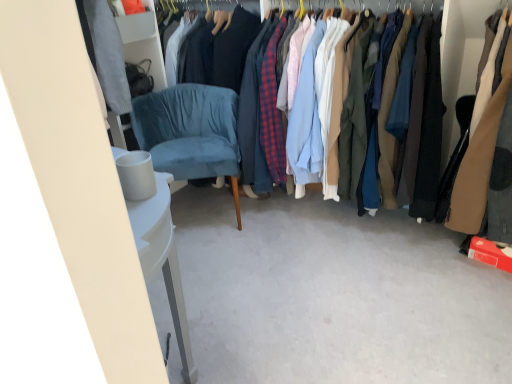
Question: Which direction should I rotate to look at matte cotton shirts at center, which is counted as the 2th clothing, starting from the right, — up or down?

Choices:
 (A) down
 (B) up

Answer: (B)

Question: Is velvet blue armchair at center-left turned away from matte cotton shirts at center, which is counted as the 2th clothing, starting from the right?

Choices:
 (A) no
 (B) yes

Answer: (A)

Question: From the image's perspective, would you say velvet blue armchair at center-left is positioned over matte cotton shirts at center, arranged as the 1th clothing when viewed from the left?

Choices:
 (A) yes
 (B) no

Answer: (B)

Question: Is velvet blue armchair at center-left placed right next to matte cotton shirts at center, arranged as the 1th clothing when viewed from the left?

Choices:
 (A) no
 (B) yes

Answer: (A)

Question: From a real-world perspective, is velvet blue armchair at center-left on matte cotton shirts at center, which is counted as the 2th clothing, starting from the right?

Choices:
 (A) no
 (B) yes

Answer: (A)

Question: Can you confirm if velvet blue armchair at center-left is taller than matte cotton shirts at center, arranged as the 1th clothing when viewed from the left?

Choices:
 (A) yes
 (B) no

Answer: (B)

Question: From the image's perspective, is velvet blue armchair at center-left below matte cotton shirts at center, arranged as the 1th clothing when viewed from the left?

Choices:
 (A) yes
 (B) no

Answer: (A)

Question: Is white matte trash bin at lower left completely or partially outside of brown leather jacket at right, which appears as the first clothing when viewed from the right?

Choices:
 (A) yes
 (B) no

Answer: (A)

Question: Would you consider white matte trash bin at lower left to be distant from brown leather jacket at right, the second clothing viewed from the left?

Choices:
 (A) yes
 (B) no

Answer: (A)

Question: Considering the relative sizes of white matte trash bin at lower left and brown leather jacket at right, the second clothing viewed from the left, in the image provided, is white matte trash bin at lower left smaller than brown leather jacket at right, the second clothing viewed from the left,?

Choices:
 (A) yes
 (B) no

Answer: (A)

Question: Considering the relative positions of white matte trash bin at lower left and brown leather jacket at right, which appears as the first clothing when viewed from the right, in the image provided, is white matte trash bin at lower left behind brown leather jacket at right, which appears as the first clothing when viewed from the right,?

Choices:
 (A) yes
 (B) no

Answer: (B)

Question: Is white matte trash bin at lower left at the left side of brown leather jacket at right, which appears as the first clothing when viewed from the right?

Choices:
 (A) no
 (B) yes

Answer: (B)

Question: Is white matte trash bin at lower left closer to the viewer compared to brown leather jacket at right, which appears as the first clothing when viewed from the right?

Choices:
 (A) yes
 (B) no

Answer: (A)

Question: Is matte cotton shirts at center, which is counted as the 2th clothing, starting from the right, at the left side of velvet blue armchair at center-left?

Choices:
 (A) no
 (B) yes

Answer: (A)